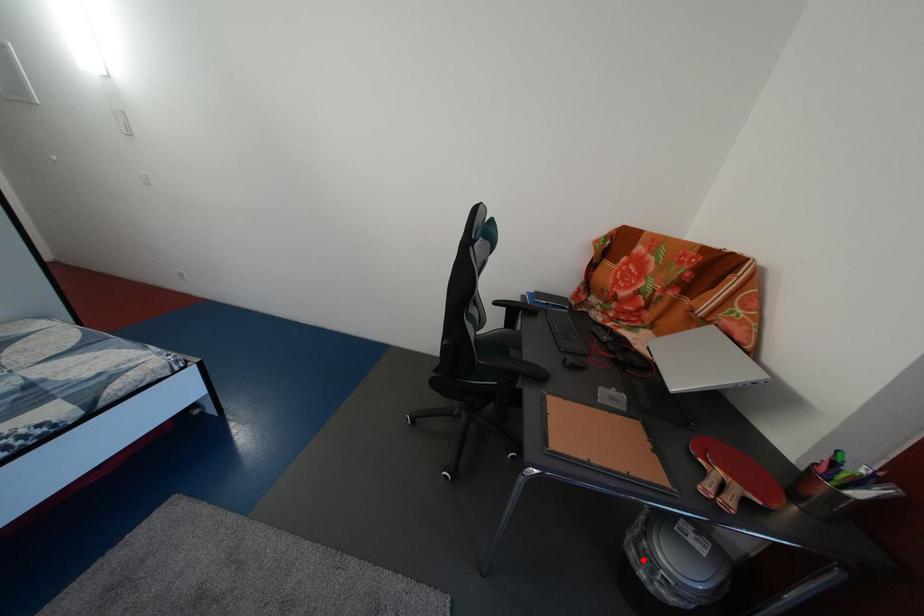
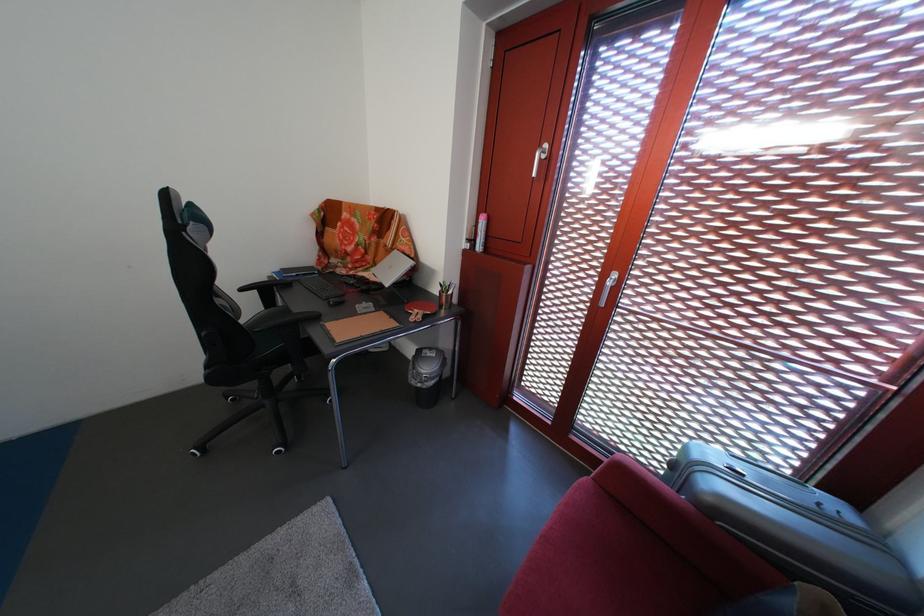
Question: I am providing you with two images of the same scene from different viewpoints. Image1 has a red point marked. In image2, the corresponding 3D location appears at what relative position? Reply with the corresponding letter.

Choices:
 (A) Closer
 (B) Farther

Answer: (B)